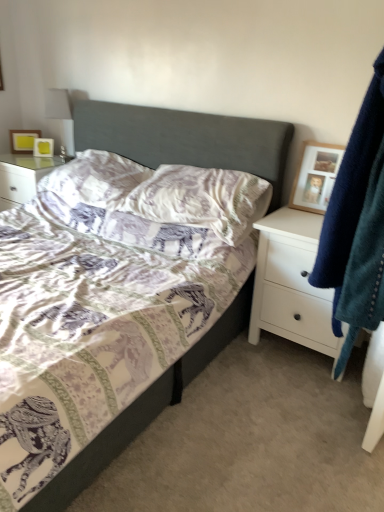
The image size is (384, 512). I want to click on free spot below velvety blue robe at right (from a real-world perspective), so click(x=340, y=420).